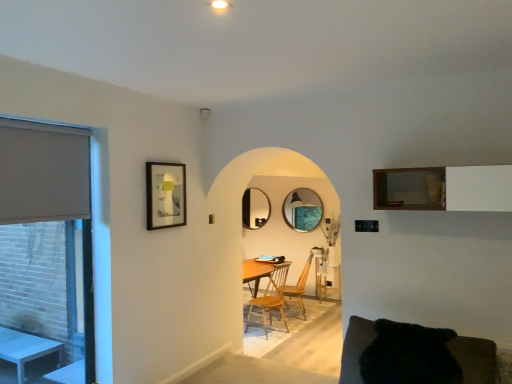
Question: In terms of width, does matte glass mirror at center, placed as the 2th mirror when sorted from back to front, look wider or thinner when compared to beige fabric window at left?

Choices:
 (A) wide
 (B) thin

Answer: (A)

Question: Would you say matte glass mirror at center, marked as the 1th mirror in a right-to-left arrangement, is to the left or to the right of beige fabric window at left in the picture?

Choices:
 (A) right
 (B) left

Answer: (A)

Question: Which object is the farthest from the matte gray roller blind at left?

Choices:
 (A) matte black mirror at center, the second mirror when ordered from right to left
 (B) beige fabric window at left
 (C) wooden frame at upper right
 (D) wooden chair at center, which is the 2th chair from front to back
 (E) wooden chair at center, placed as the first chair when sorted from front to back

Answer: (D)

Question: Estimate the real-world distances between objects in this image. Which object is farther from the black fuzzy couch at lower right?

Choices:
 (A) wooden framed artwork at upper left
 (B) matte black mirror at center, marked as the 1th mirror in a left-to-right arrangement
 (C) wooden frame at upper right
 (D) wooden chair at center, positioned as the second chair in back-to-front order
 (E) matte gray roller blind at left

Answer: (B)